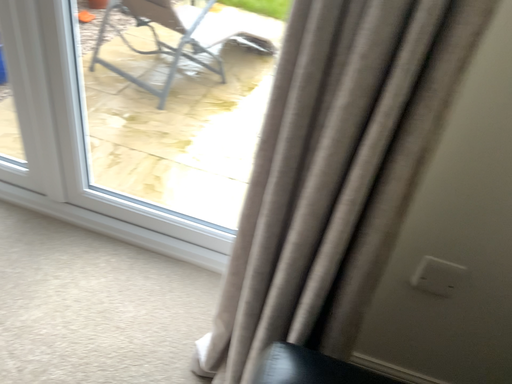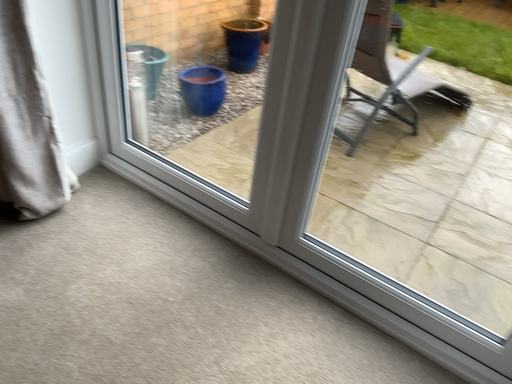
Question: Which way did the camera rotate in the video?

Choices:
 (A) rotated left
 (B) rotated right

Answer: (A)